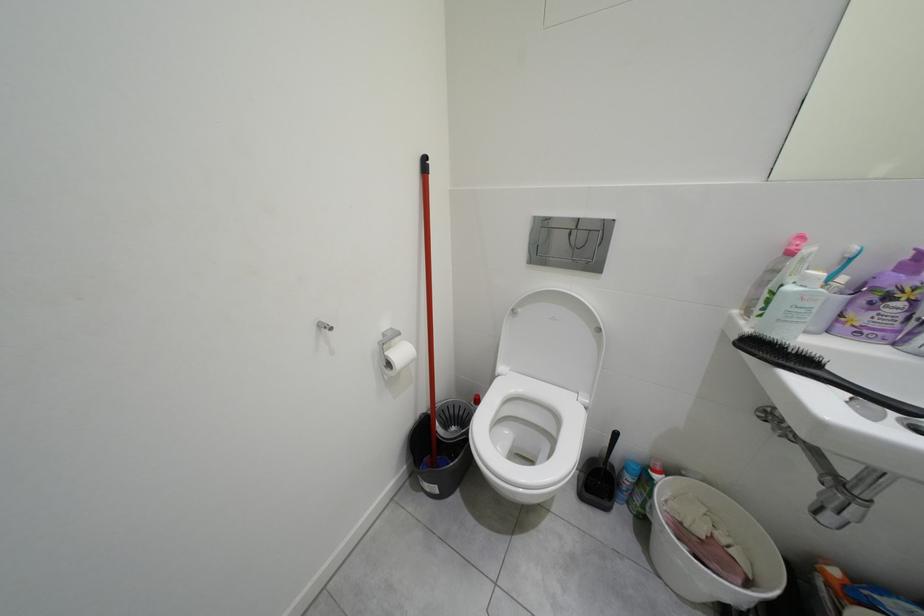
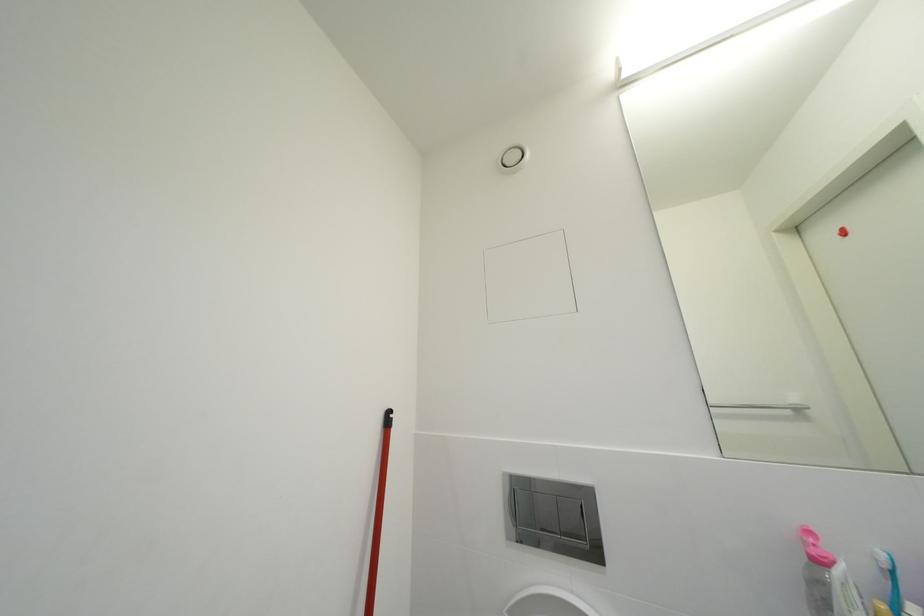
Question: Based on the continuous images, in which direction is the camera rotating? Reply with the corresponding letter.

Choices:
 (A) Left
 (B) Right
 (C) Up
 (D) Down

Answer: (C)